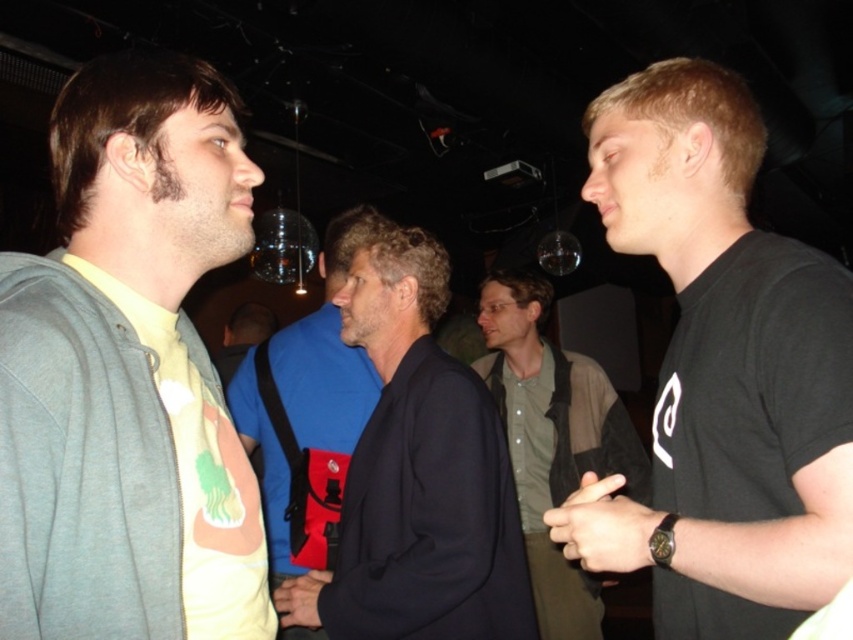
You are a bartender who needs to deliver a drink to the person wearing the dark blue jacket at center and the green shirt at center. What is the minimum distance you need to cover to reach both of them?

The dark blue jacket at center and green shirt at center are 3.31 feet apart. To reach both, the bartender must cover at least 3.31 feet.